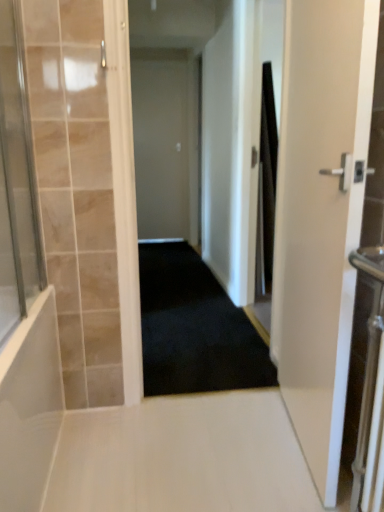
Question: In the image, is white glossy floor at center on the left side or the right side of black fabric shower curtain at right?

Choices:
 (A) right
 (B) left

Answer: (B)

Question: In terms of width, does white glossy floor at center look wider or thinner when compared to black fabric shower curtain at right?

Choices:
 (A) wide
 (B) thin

Answer: (A)

Question: Based on their relative distances, which object is nearer to the black fabric shower curtain at right?

Choices:
 (A) transparent glass shower door at left
 (B) white matte door at center, which ranks as the 1th door in back-to-front order
 (C) black carpet at center
 (D) white glossy door at right, placed as the first door when sorted from right to left
 (E) white glossy floor at center

Answer: (C)

Question: Considering the real-world distances, which object is closest to the white glossy floor at center?

Choices:
 (A) transparent glass shower door at left
 (B) black carpet at center
 (C) white matte door at center, which ranks as the 1th door in back-to-front order
 (D) black fabric shower curtain at right
 (E) white glossy door at right, acting as the 2th door starting from the back

Answer: (B)